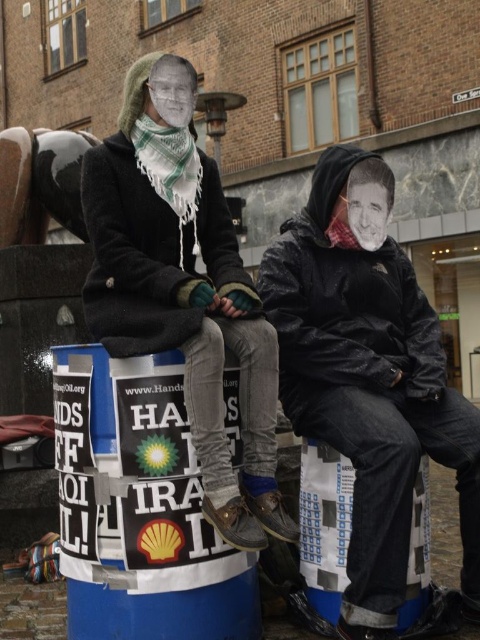
Question: Which object appears closest to the camera in this image?

Choices:
 (A) wet black jacket at center
 (B) matte black coat at upper left

Answer: (B)

Question: Where is wet black jacket at center located in relation to matte black coat at upper left in the image?

Choices:
 (A) above
 (B) below

Answer: (B)

Question: Which point is closer to the camera?

Choices:
 (A) matte black coat at upper left
 (B) wet black jacket at center

Answer: (A)

Question: Considering the relative positions of wet black jacket at center and matte black coat at upper left in the image provided, where is wet black jacket at center located with respect to matte black coat at upper left?

Choices:
 (A) right
 (B) left

Answer: (A)

Question: Observing the image, what is the correct spatial positioning of wet black jacket at center in reference to matte black coat at upper left?

Choices:
 (A) right
 (B) left

Answer: (A)